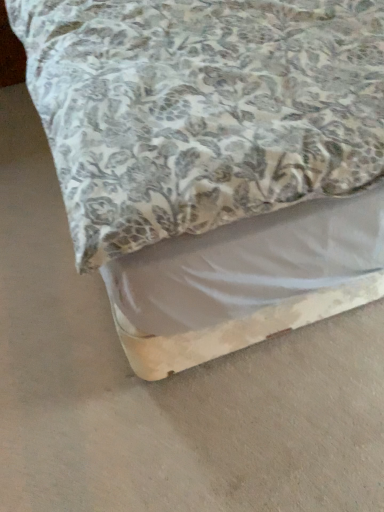
This screenshot has height=512, width=384. Describe the element at coordinates (215, 162) in the screenshot. I see `white fabric bed at center` at that location.

At what (x,y) coordinates should I click in order to perform the action: click on white fabric bed at center. Please return your answer as a coordinate pair (x, y). Looking at the image, I should click on (215, 162).

This screenshot has width=384, height=512. Identify the location of white fabric bed at center. (215, 162).